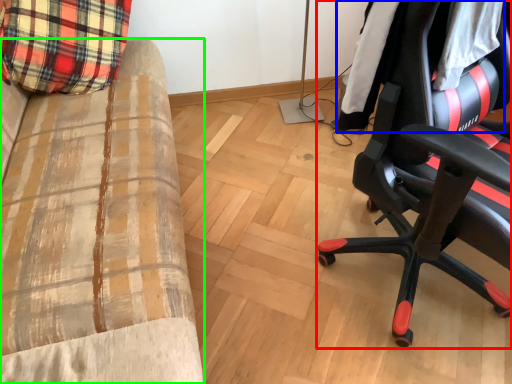
Question: Estimate the real-world distances between objects in this image. Which object is closer to chair (highlighted by a red box), clothing (highlighted by a blue box) or furniture (highlighted by a green box)?

Choices:
 (A) clothing
 (B) furniture

Answer: (A)